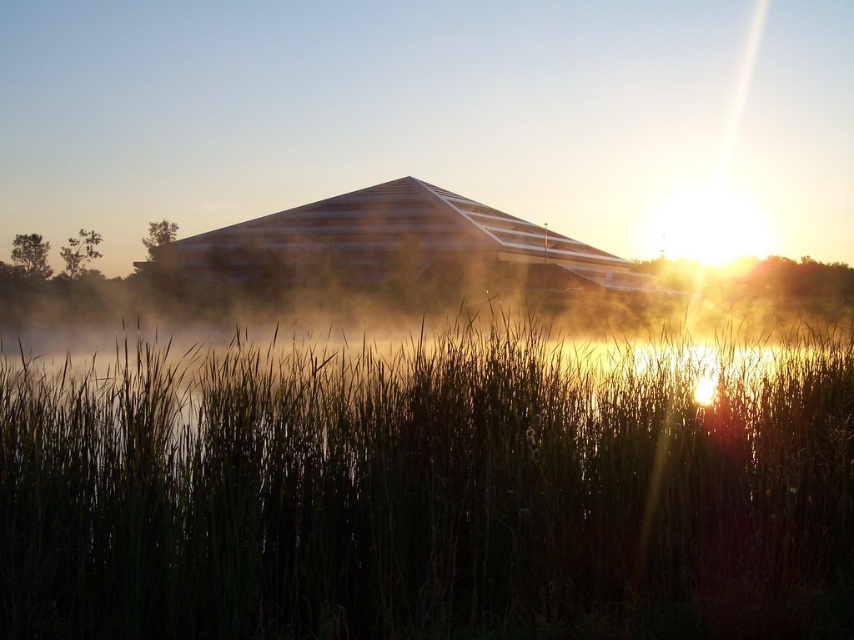
Question: Which of the following is the farthest from the observer?

Choices:
 (A) (638, 294)
 (B) (752, 435)

Answer: (A)

Question: Does green grass at center come in front of wooden barn at center?

Choices:
 (A) no
 (B) yes

Answer: (B)

Question: Which of the following is the closest to the observer?

Choices:
 (A) wooden barn at center
 (B) green grass at center

Answer: (B)

Question: Can you confirm if green grass at center is positioned to the right of wooden barn at center?

Choices:
 (A) no
 (B) yes

Answer: (A)

Question: Where is green grass at center located in relation to wooden barn at center in the image?

Choices:
 (A) left
 (B) right

Answer: (A)

Question: Which point is closer to the camera taking this photo?

Choices:
 (A) (145, 262)
 (B) (301, 464)

Answer: (B)